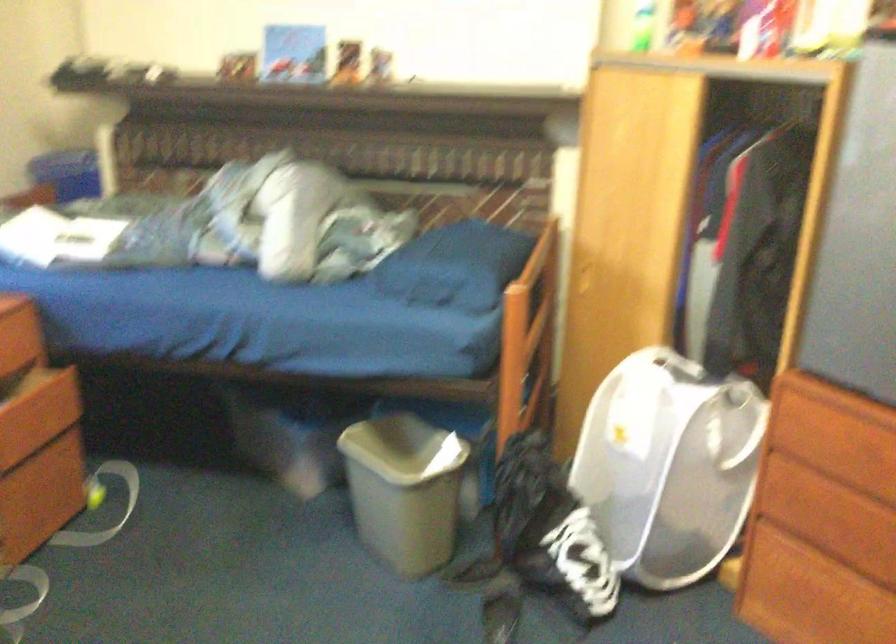
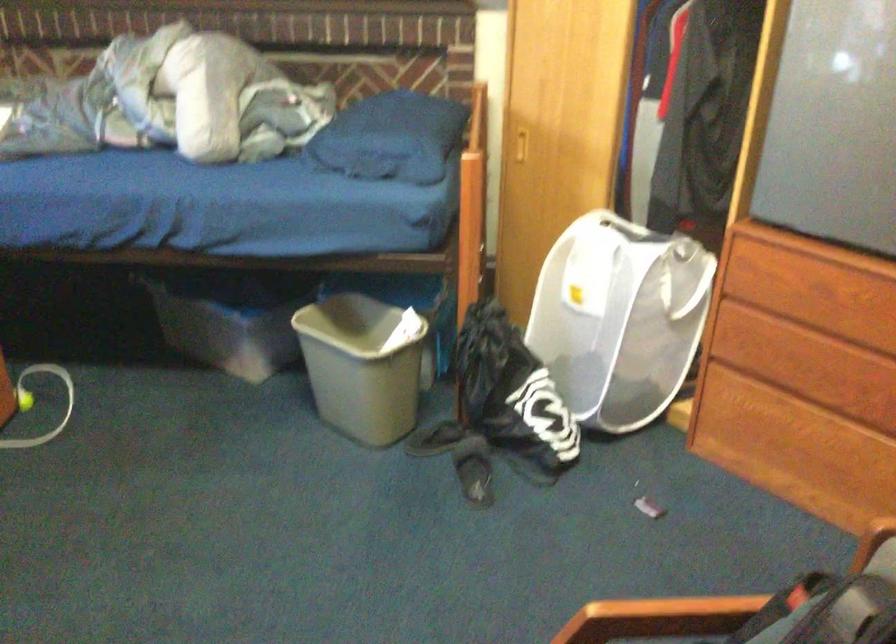
Question: In a continuous first-person perspective shot, in which direction is the camera moving?

Choices:
 (A) Left
 (B) Right
 (C) Forward
 (D) Backward

Answer: (A)